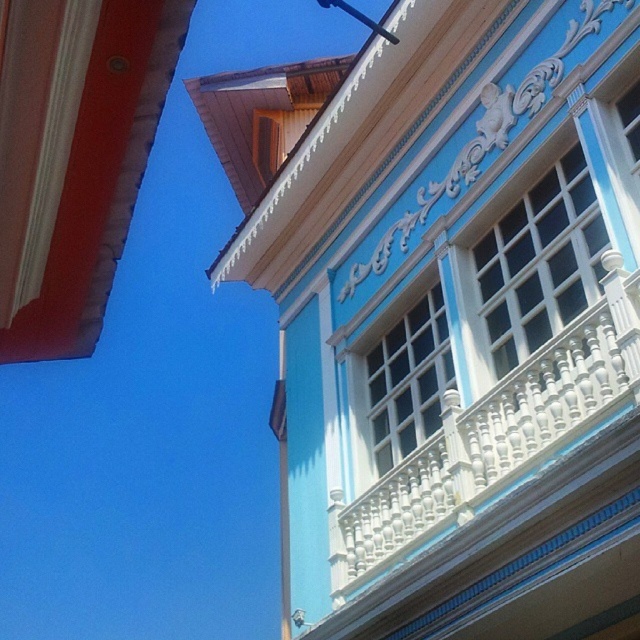
Can you confirm if white carved wood balcony at upper right is thinner than metallic pole at upper center?

Yes.

Does white carved wood balcony at upper right appear on the right side of metallic pole at upper center?

Correct, you'll find white carved wood balcony at upper right to the right of metallic pole at upper center.

Which is in front, point (339, 538) or point (323, 1)?

Point (323, 1) is in front.

The image size is (640, 640). I want to click on white carved wood balcony at upper right, so click(x=492, y=436).

Does white carved wood balcony at upper right appear under white wooden window at center?

Yes.

Does white carved wood balcony at upper right have a lesser width compared to white wooden window at center?

Incorrect, white carved wood balcony at upper right's width is not less than white wooden window at center's.

Measure the distance between point (381, 490) and camera.

Point (381, 490) is 17.25 meters away from camera.

Find the location of `white carved wood balcony at upper right`. white carved wood balcony at upper right is located at coordinates click(492, 436).

Does white textured wood at upper right have a greater width compared to metallic pole at upper center?

Incorrect, white textured wood at upper right's width does not surpass metallic pole at upper center's.

Can you confirm if white textured wood at upper right is shorter than metallic pole at upper center?

Indeed, white textured wood at upper right has a lesser height compared to metallic pole at upper center.

Who is more distant from viewer, (502, 241) or (342, 1)?

The point (342, 1) is more distant.

You are a GUI agent. You are given a task and a screenshot of the screen. Output one action in this format:
    pyautogui.click(x=<x>, y=<y>)
    Task: Click on the white textured wood at upper right
    This screenshot has width=640, height=640.
    Given the screenshot: What is the action you would take?
    pyautogui.click(x=540, y=262)